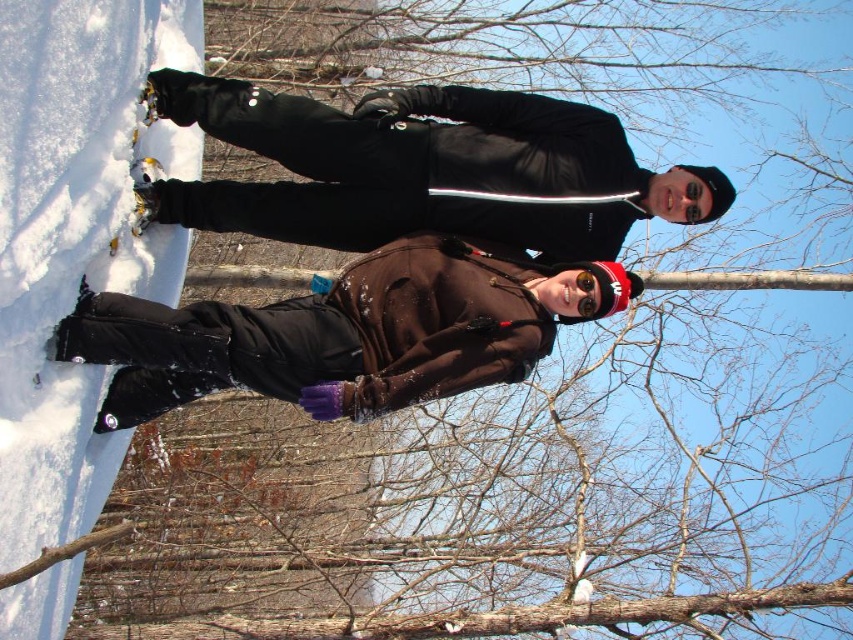
Question: Is black matte jacket at upper center to the right of brown matte jacket at center from the viewer's perspective?

Choices:
 (A) yes
 (B) no

Answer: (A)

Question: Which point is closer to the camera?

Choices:
 (A) black matte jacket at upper center
 (B) brown matte jacket at center

Answer: (B)

Question: Does black matte jacket at upper center appear over brown matte jacket at center?

Choices:
 (A) no
 (B) yes

Answer: (B)

Question: Among these points, which one is farthest from the camera?

Choices:
 (A) (302, 228)
 (B) (346, 301)

Answer: (A)

Question: Which object is farther from the camera taking this photo?

Choices:
 (A) black matte jacket at upper center
 (B) brown matte jacket at center

Answer: (A)

Question: Does black matte jacket at upper center have a lesser width compared to brown matte jacket at center?

Choices:
 (A) yes
 (B) no

Answer: (B)